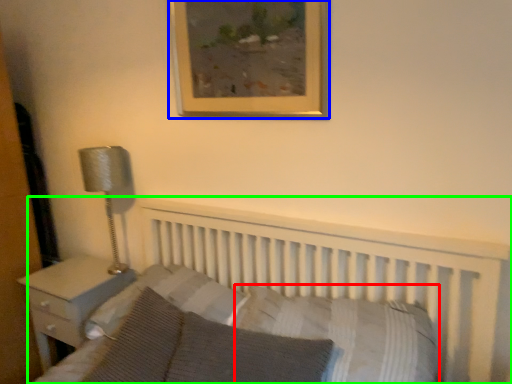
Question: Which object is positioned farthest from pillow (highlighted by a red box)? Select from picture frame (highlighted by a blue box) and bed (highlighted by a green box).

Choices:
 (A) picture frame
 (B) bed

Answer: (A)